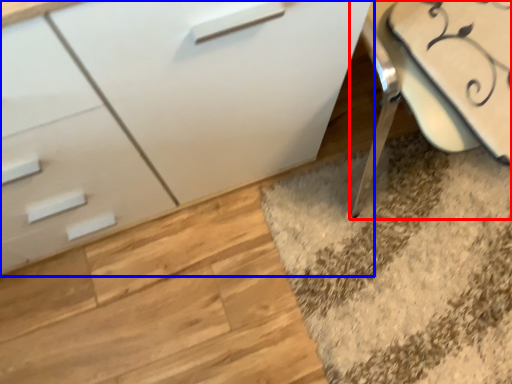
Question: Which point is closer to the camera, swivel chair (highlighted by a red box) or chest of drawers (highlighted by a blue box)?

Choices:
 (A) swivel chair
 (B) chest of drawers

Answer: (B)